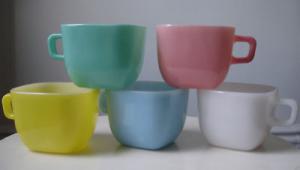
Locate an element on the screen. Image resolution: width=300 pixels, height=170 pixels. top row of cups is located at coordinates (102, 42), (180, 54).